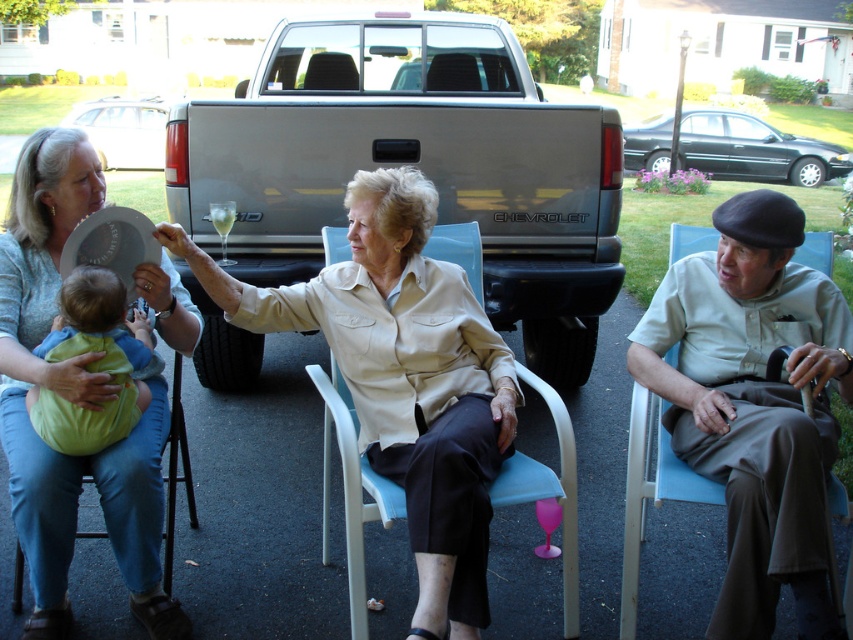
Question: Is beige fabric chair at center above soft green fabric baby at center left?

Choices:
 (A) yes
 (B) no

Answer: (B)

Question: Which object is positioned closest to the matte beige blouse at center?

Choices:
 (A) soft green fabric baby at center left
 (B) light beige shirt at center

Answer: (A)

Question: Where is light beige shirt at center located in relation to soft green fabric baby at center left in the image?

Choices:
 (A) right
 (B) left

Answer: (A)

Question: Which point is farther from the camera taking this photo?

Choices:
 (A) (316, 305)
 (B) (115, 346)
 (C) (730, 557)

Answer: (A)

Question: Which of the following is the closest to the observer?

Choices:
 (A) soft green fabric baby at center left
 (B) matte beige blouse at center
 (C) light beige shirt at center

Answer: (C)

Question: Is light beige shirt at center below matte beige blouse at center?

Choices:
 (A) yes
 (B) no

Answer: (A)